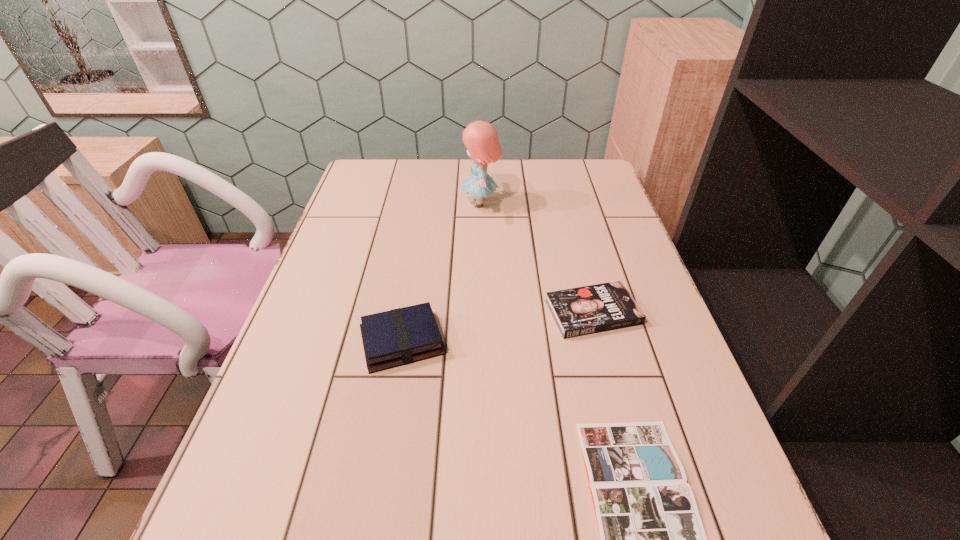
Identify the location of doll. This screenshot has height=540, width=960. (481, 139).

Identify the location of the third object from right to left. (481, 139).

Locate an element on the screen. the leftmost object is located at coordinates (401, 336).

What are the coordinates of `the tallest book` in the screenshot? It's located at (401, 336).

Find the location of `the second shortest object`. the second shortest object is located at coordinates (591, 309).

Locate an element on the screen. vacant space located 0.120m on the front-facing side of the third object from right to left is located at coordinates (421, 203).

The image size is (960, 540). Identify the location of vacant space located 0.220m on the front-facing side of the third object from right to left. (389, 203).

This screenshot has width=960, height=540. Find the location of `free region located 0.120m on the front-facing side of the third object from right to left`. free region located 0.120m on the front-facing side of the third object from right to left is located at coordinates 421,203.

At what (x,y) coordinates should I click in order to perform the action: click on free space located on the front of the leftmost book. Please return your answer as a coordinate pair (x, y). The image size is (960, 540). Looking at the image, I should click on (385, 444).

Identify the location of free space located 0.160m on the left of the second shortest book. This screenshot has height=540, width=960. (478, 312).